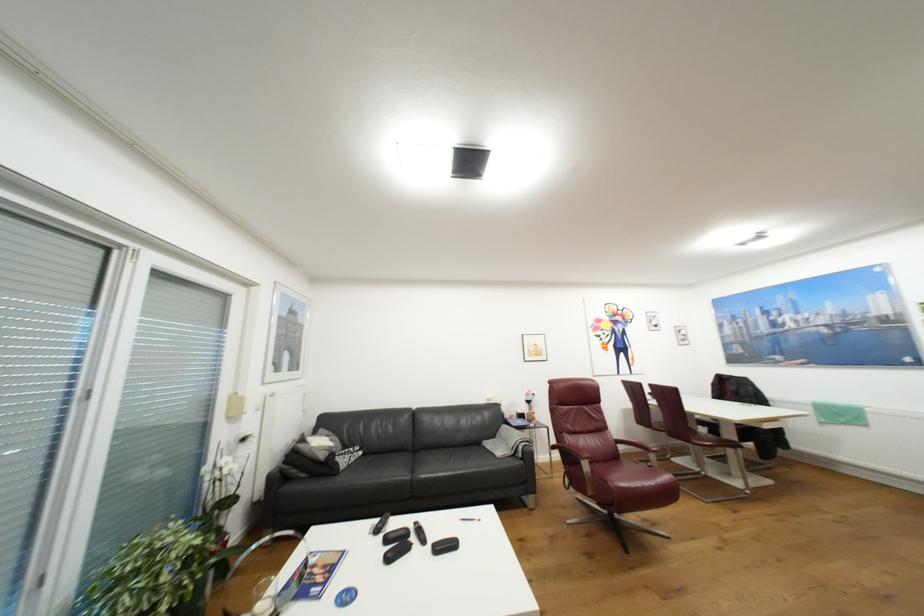
At what (x,y) coordinates should I click in order to perform the action: click on red chair armrest. Please return your answer as a coordinate pair (x, y). Image resolution: width=924 pixels, height=616 pixels. Looking at the image, I should click on click(573, 454).